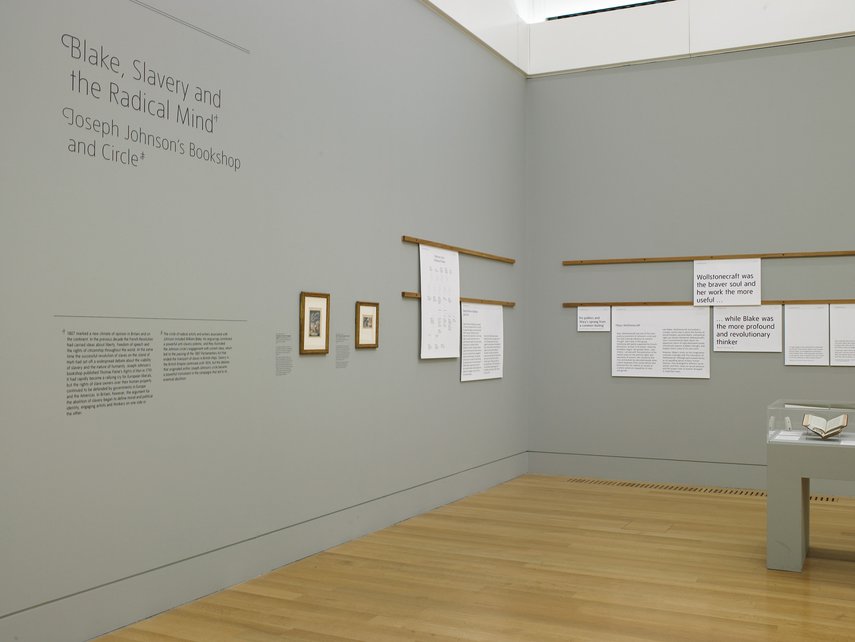
Where is `1 area of wooden floor surface`? 1 area of wooden floor surface is located at coordinates (408, 583).